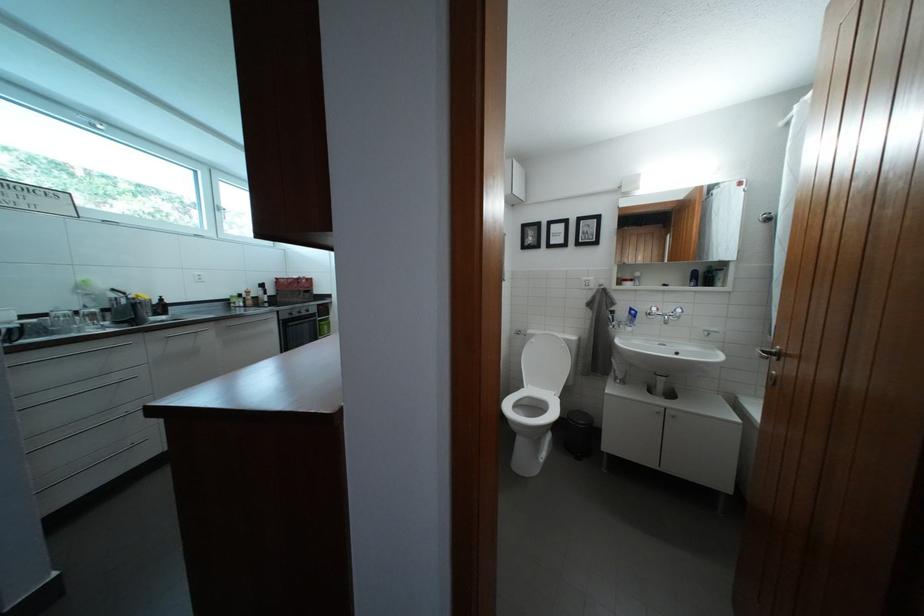
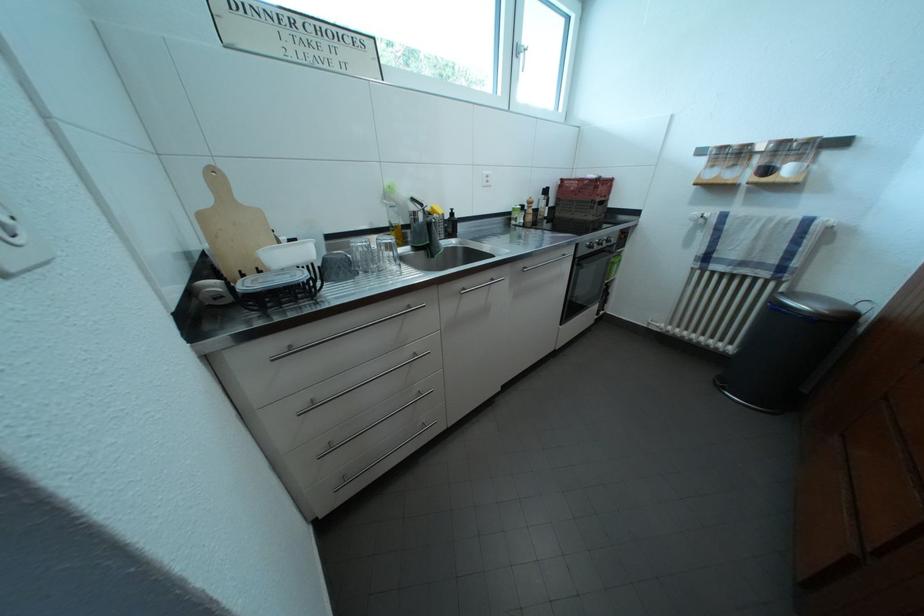
Locate, in the second image, the point that corresponds to (x=226, y=214) in the first image.

(525, 55)